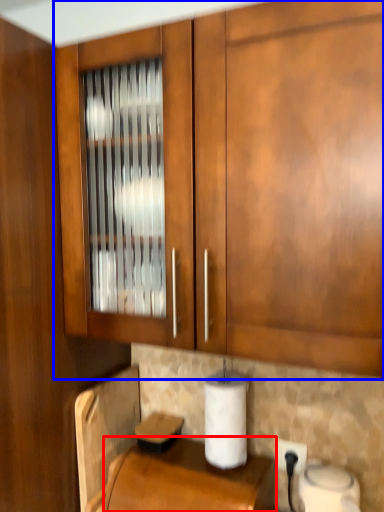
Question: Which of the following is the closest to the observer, counter top (highlighted by a red box) or cabinetry (highlighted by a blue box)?

Choices:
 (A) counter top
 (B) cabinetry

Answer: (B)